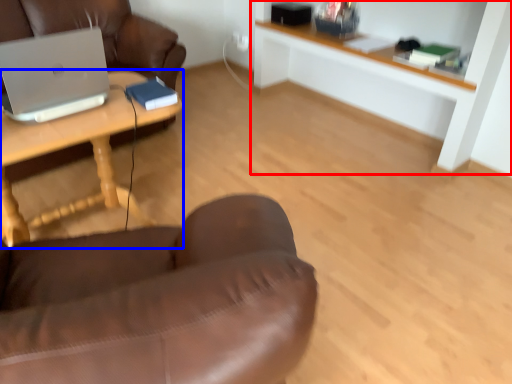
Question: Which object appears farthest to the camera in this image, shelf (highlighted by a red box) or desk (highlighted by a blue box)?

Choices:
 (A) shelf
 (B) desk

Answer: (A)